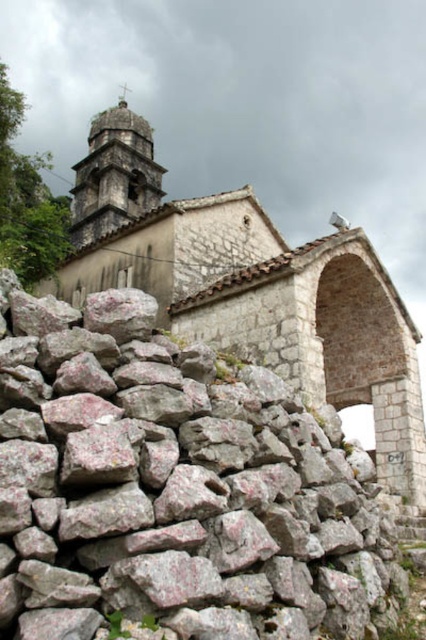
You are standing in front of the rustic stone structure and want to locate the point at coordinates (252, 291). Based on the description, where would this point be located?

The point at coordinates (252, 291) is located on the light beige stone church at upper center.